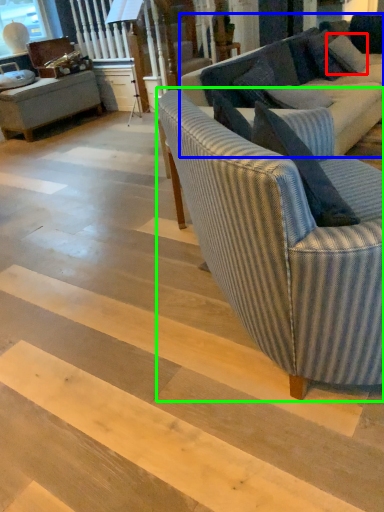
Question: Estimate the real-world distances between objects in this image. Which object is closer to pillow (highlighted by a red box), studio couch (highlighted by a blue box) or studio couch (highlighted by a green box)?

Choices:
 (A) studio couch
 (B) studio couch

Answer: (A)